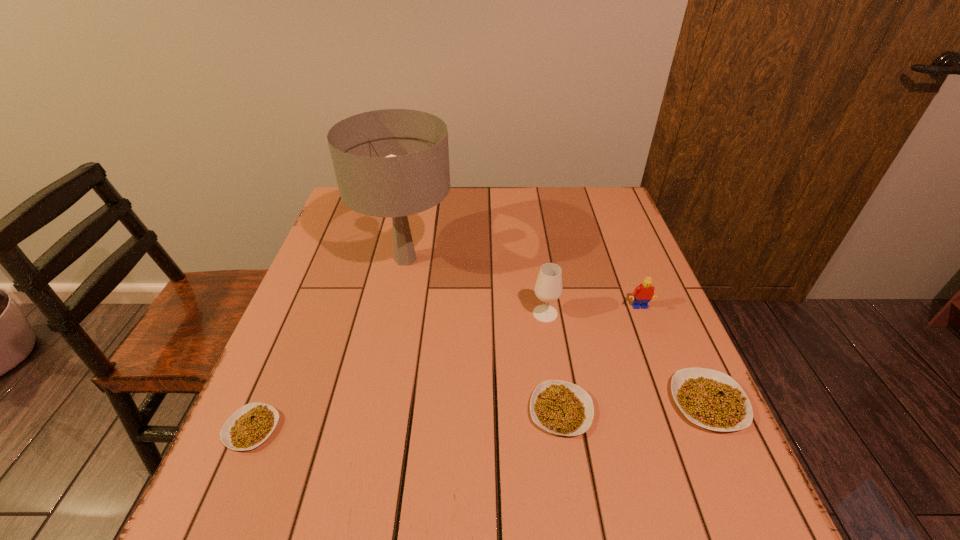
At what (x,y) coordinates should I click in order to perform the action: click on free space for an extra legume to achieve even spacing. Please return your answer as a coordinate pair (x, y). This screenshot has width=960, height=540. Looking at the image, I should click on (409, 419).